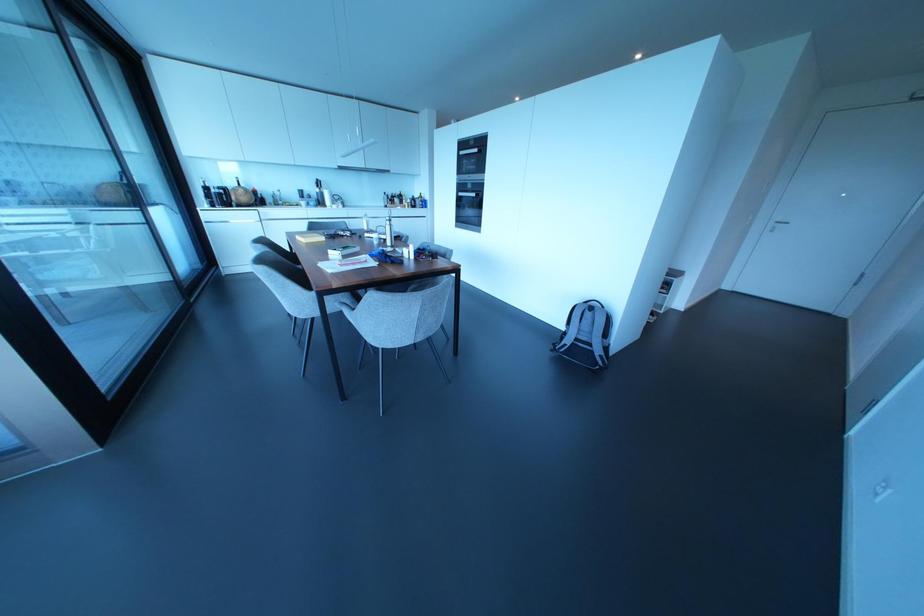
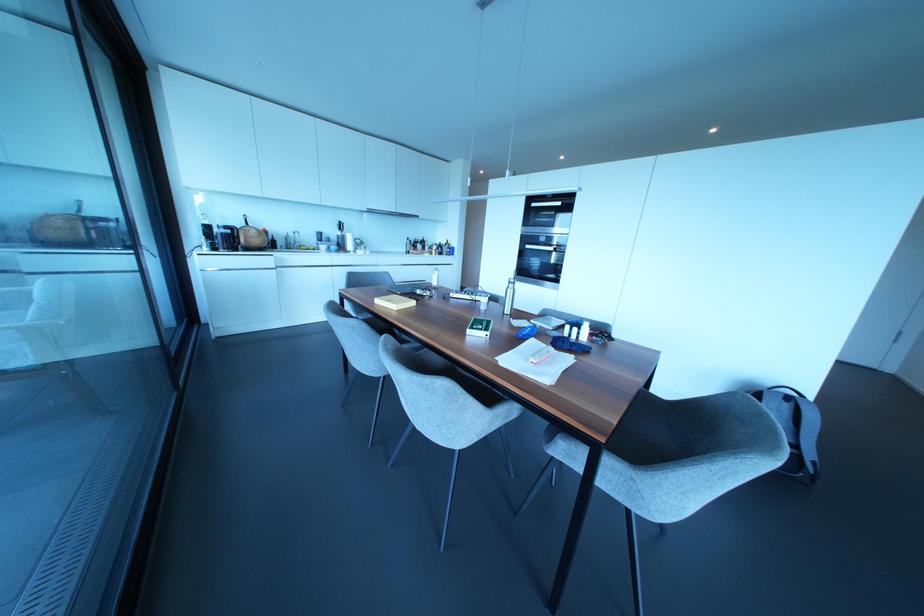
Where in the second image is the point corresponding to [322,238] from the first image?

(411, 302)